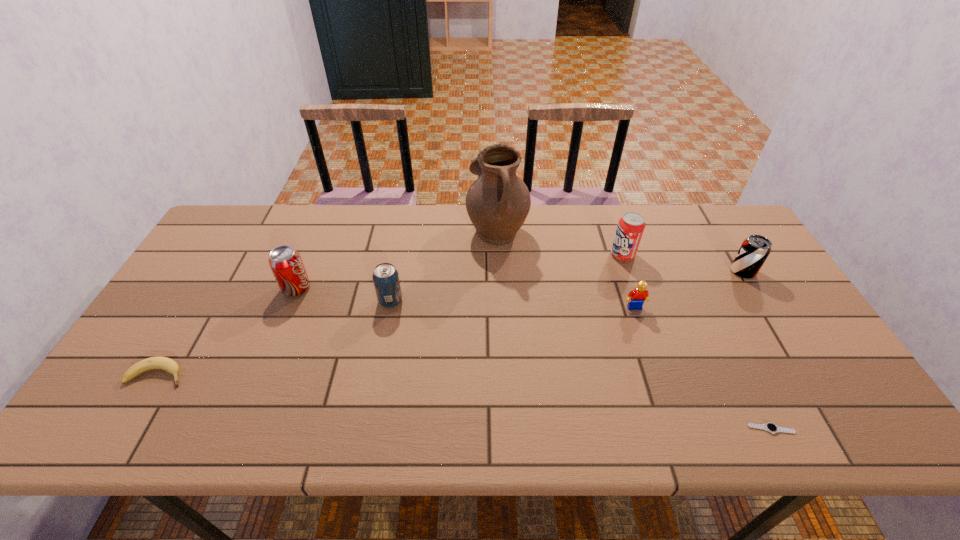
Identify the location of vacant space that is in between the third shortest object and the nearest object. (703, 368).

Where is `unoccupied position between the seventh object from right to left and the third shortest object`? unoccupied position between the seventh object from right to left and the third shortest object is located at coordinates (466, 298).

This screenshot has width=960, height=540. I want to click on free space that is in between the third soda can from left to right and the third object from left to right, so click(507, 278).

You are a GUI agent. You are given a task and a screenshot of the screen. Output one action in this format:
    pyautogui.click(x=<x>, y=<y>)
    Task: Click on the object that is the sixth closest one to the seventh object from right to left
    
    Given the screenshot: What is the action you would take?
    pyautogui.click(x=770, y=427)

Select which object appears as the third closest to the nearest object. Please provide its 2D coordinates. Your answer should be formatted as a tuple, i.e. [(x, y)], where the tuple contains the x and y coordinates of a point satisfying the conditions above.

[(630, 228)]

What are the coordinates of `soda can that stands as the third closest to the Lego` in the screenshot? It's located at (385, 276).

You are a GUI agent. You are given a task and a screenshot of the screen. Output one action in this format:
    pyautogui.click(x=<x>, y=<y>)
    Task: Click on the soda can that stands as the closest to the third soda can from left to right
    This screenshot has height=540, width=960.
    Given the screenshot: What is the action you would take?
    pyautogui.click(x=752, y=254)

The height and width of the screenshot is (540, 960). Identify the location of free space that satisfies the following two spatial constraints: 1. on the surface of the second soda can from right to left; 2. on the front side of the second soda can from left to right. (638, 301).

Find the location of a particular element. Image resolution: width=960 pixels, height=540 pixels. free spot that satisfies the following two spatial constraints: 1. at the stem of the second nearest object; 2. on the left side of the watch is located at coordinates (126, 429).

You are a GUI agent. You are given a task and a screenshot of the screen. Output one action in this format:
    pyautogui.click(x=<x>, y=<y>)
    Task: Click on the vacant point that satisfies the following two spatial constraints: 1. on the front side of the leftmost soda can; 2. at the stem of the seventh tallest object
    Image resolution: width=960 pixels, height=540 pixels.
    Given the screenshot: What is the action you would take?
    pyautogui.click(x=261, y=375)